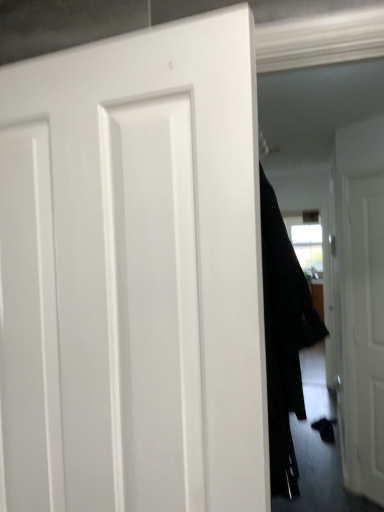
Question: From the image's perspective, is black fabric coat at center above white matte door at center, the first door positioned from the front?

Choices:
 (A) no
 (B) yes

Answer: (A)

Question: Is black fabric coat at center to the right of white matte door at center, acting as the second door starting from the right, from the viewer's perspective?

Choices:
 (A) yes
 (B) no

Answer: (A)

Question: Is the position of black fabric coat at center less distant than that of white matte door at center, the first door from the left?

Choices:
 (A) no
 (B) yes

Answer: (A)

Question: Is black fabric coat at center shorter than white matte door at center, the first door from the left?

Choices:
 (A) yes
 (B) no

Answer: (B)

Question: Is black fabric coat at center wider than white matte door at center, marked as the 2th door in a back-to-front arrangement?

Choices:
 (A) no
 (B) yes

Answer: (B)

Question: From the image's perspective, is white matte door at center, the first door positioned from the front, positioned above or below black fabric coat at center?

Choices:
 (A) below
 (B) above

Answer: (B)

Question: In terms of width, does white matte door at center, the first door positioned from the front, look wider or thinner when compared to black fabric coat at center?

Choices:
 (A) thin
 (B) wide

Answer: (A)

Question: Looking at the image, does white matte door at center, the first door positioned from the front, seem bigger or smaller compared to black fabric coat at center?

Choices:
 (A) big
 (B) small

Answer: (B)

Question: Is white matte door at center, the first door from the left, situated inside black fabric coat at center or outside?

Choices:
 (A) outside
 (B) inside

Answer: (A)

Question: Considering the relative positions of black fabric coat at center and white matte door at right, the 2th door in the front-to-back sequence, in the image provided, is black fabric coat at center to the left or to the right of white matte door at right, the 2th door in the front-to-back sequence,?

Choices:
 (A) left
 (B) right

Answer: (A)

Question: In terms of height, does black fabric coat at center look taller or shorter compared to white matte door at right, positioned as the 1th door in back-to-front order?

Choices:
 (A) tall
 (B) short

Answer: (B)

Question: Is black fabric coat at center in front of or behind white matte door at right, the 1th door in the right-to-left sequence, in the image?

Choices:
 (A) behind
 (B) front

Answer: (B)

Question: From a real-world perspective, is black fabric coat at center positioned above or below white matte door at right, which is the 2th door from left to right?

Choices:
 (A) above
 (B) below

Answer: (A)

Question: Is point (364, 142) closer or farther from the camera than point (286, 283)?

Choices:
 (A) farther
 (B) closer

Answer: (A)

Question: Is white matte door at right, which is the 2th door from left to right, to the left or to the right of black fabric coat at center in the image?

Choices:
 (A) right
 (B) left

Answer: (A)